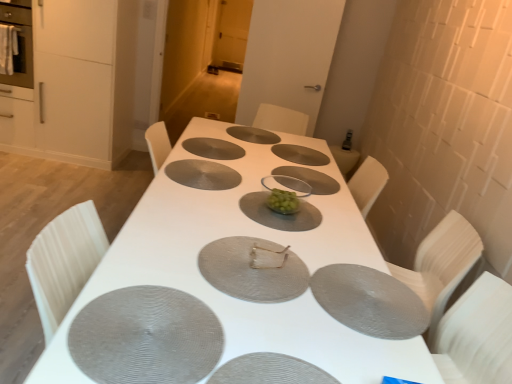
Where is `free space underneath matte gray pizza pan at center, the 3th pizza pan viewed from the back (from a real-world perspective)`? The width and height of the screenshot is (512, 384). free space underneath matte gray pizza pan at center, the 3th pizza pan viewed from the back (from a real-world perspective) is located at coordinates (221, 144).